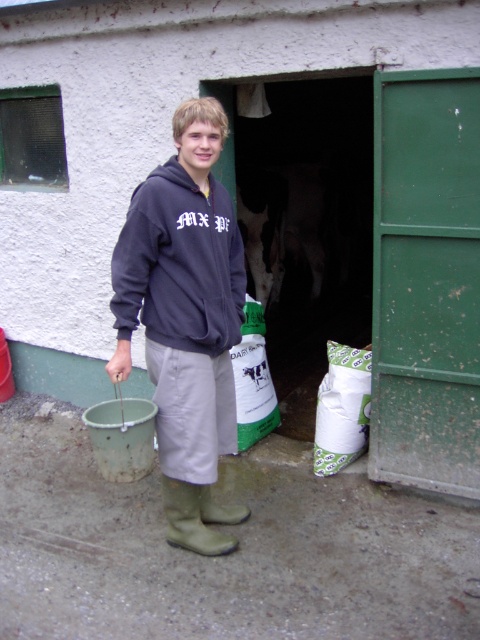
You are a farmer who needs to check the position of your clothing items. You see the dark gray fleece sweatshirt at center and the green rubber boot at lower center. Which clothing item is located more to the right?

The dark gray fleece sweatshirt at center is positioned on the right side of green rubber boot at lower center, so the dark gray fleece sweatshirt at center is more to the right.

You are a drone operator trying to deliver a package to the matte gray hoodie at center. The delivery zone is a 0.1 meter radius around the hoodie. If the drone is currently at coordinates 0.500, 0.388, is it within the delivery zone?

The matte gray hoodie at center is located at point [186,320]. Since the drone is at the same coordinates, it is exactly at the center of the delivery zone, so it is within the 0.1 meter radius.